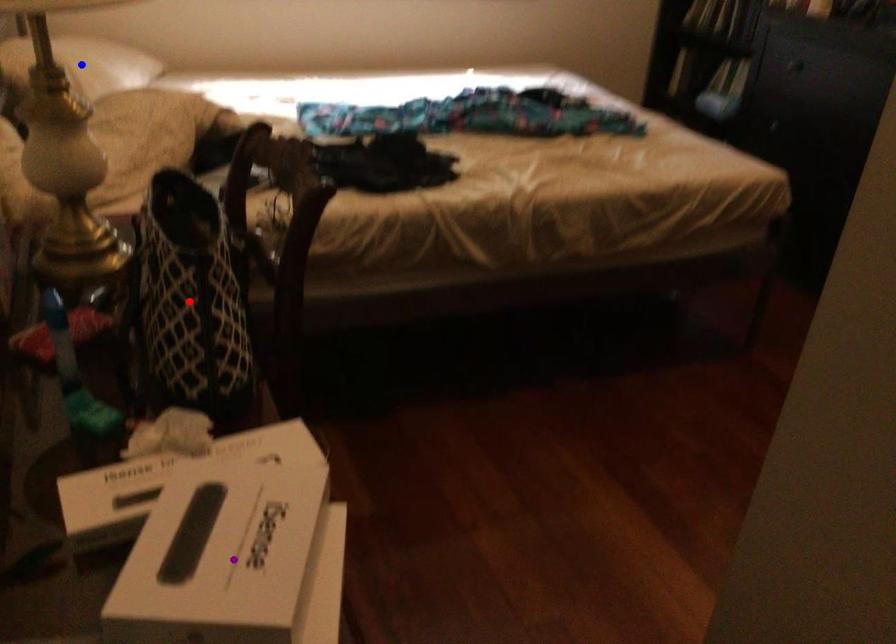
Order these from nearest to farthest:
purple point
blue point
red point

purple point, red point, blue point